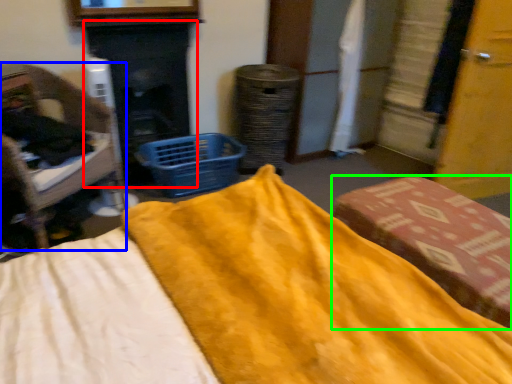
Question: Which object is positioned closest to fireplace (highlighted by a red box)? Select from furniture (highlighted by a blue box) and furniture (highlighted by a green box).

Choices:
 (A) furniture
 (B) furniture

Answer: (A)